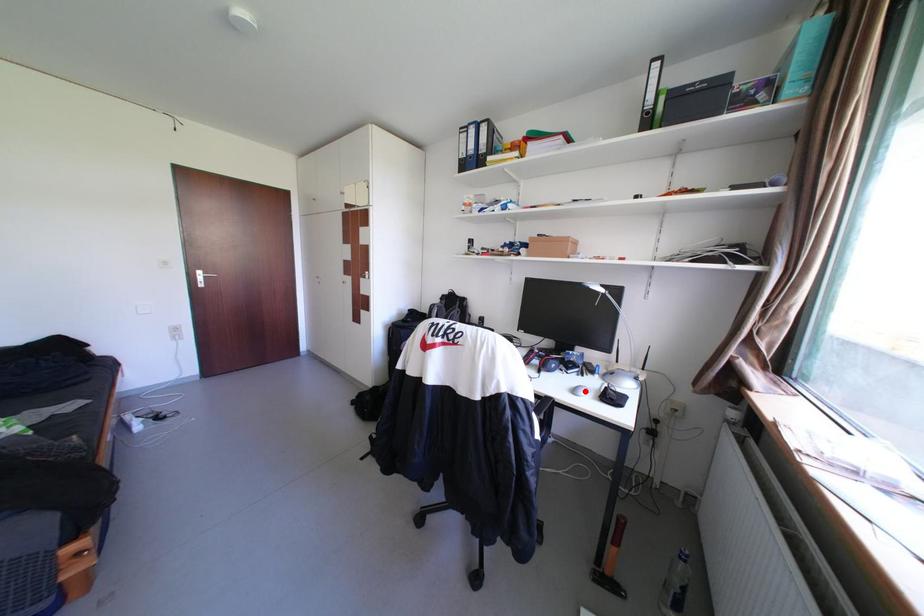
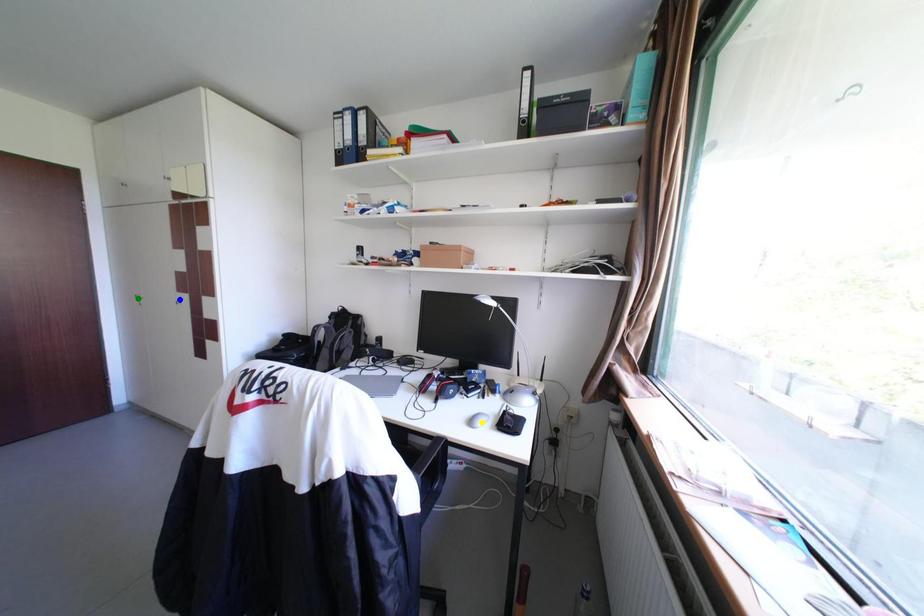
Question: I am providing you with two images of the same scene from different viewpoints. A red point is marked on the first image. You are given multiple points on the second image. In image 2, which mark is for the same physical point as the one in image 1?

Choices:
 (A) yellow point
 (B) green point
 (C) blue point

Answer: (A)